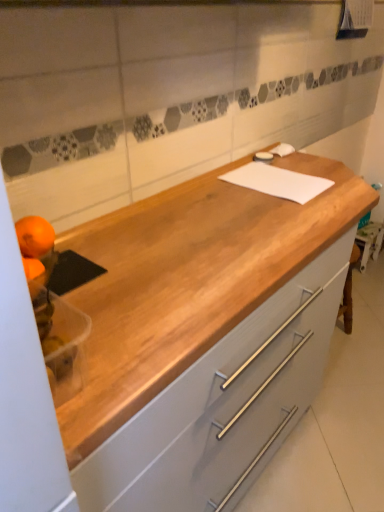
You are a GUI agent. You are given a task and a screenshot of the screen. Output one action in this format:
    pyautogui.click(x=<x>, y=<y>)
    Task: Click on the free space below white matte cutting board at center (from a real-world perspective)
    The image size is (384, 512).
    Given the screenshot: What is the action you would take?
    pyautogui.click(x=284, y=180)